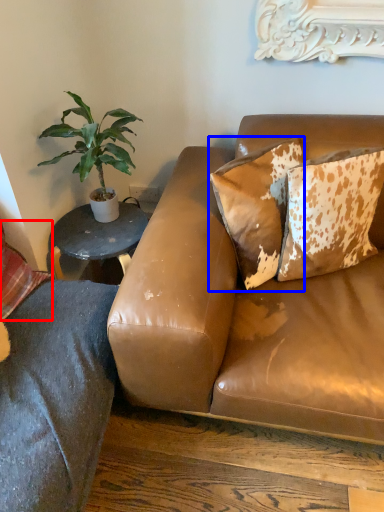
Question: Which point is closer to the camera, pillow (highlighted by a red box) or pillow (highlighted by a blue box)?

Choices:
 (A) pillow
 (B) pillow

Answer: (A)